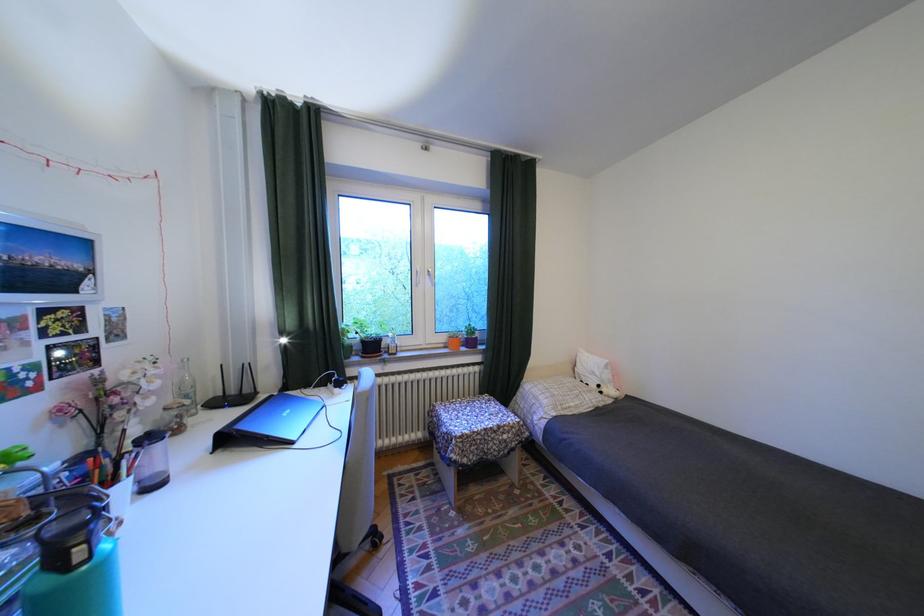
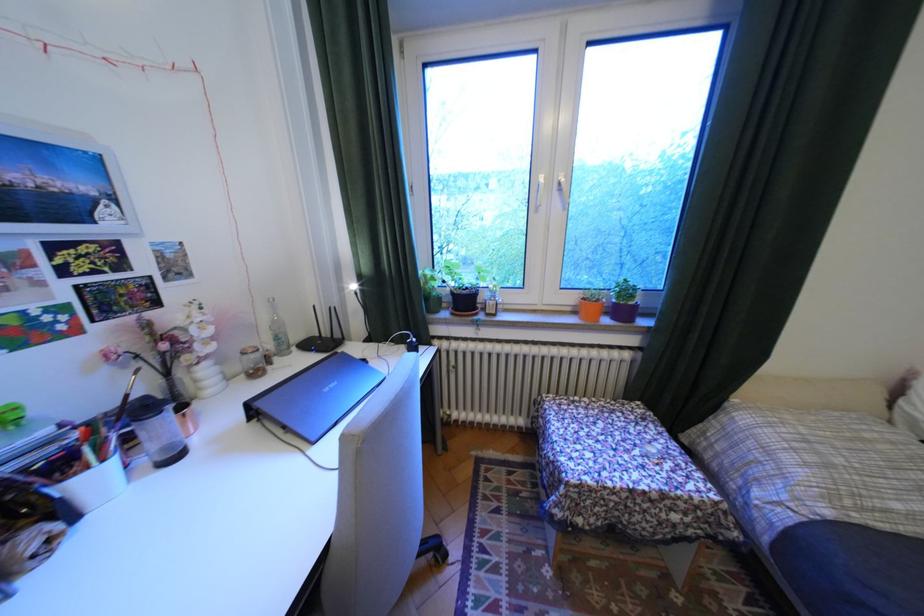
The point at (454, 345) is marked in the first image. Where is the corresponding point in the second image?

(580, 309)